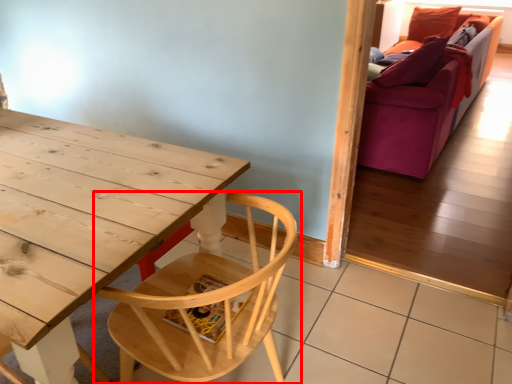
Question: From the image's perspective, where is chair (annotated by the red box) located in relation to studio couch in the image?

Choices:
 (A) above
 (B) below

Answer: (B)